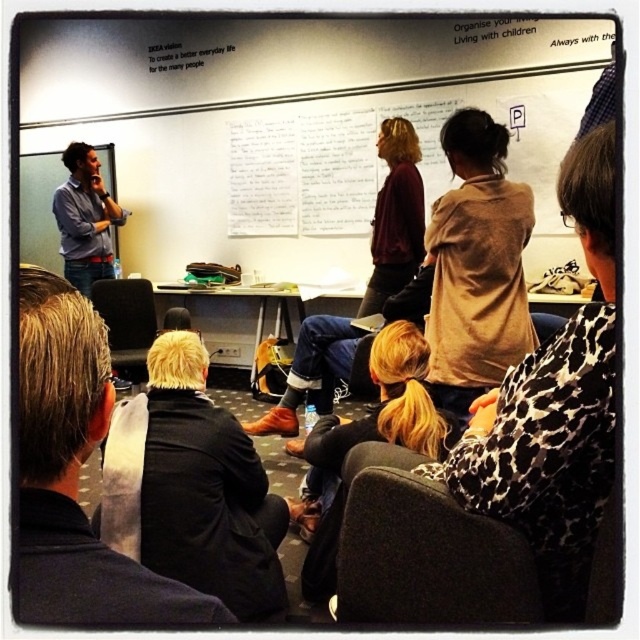
Does dark brown hair at lower left have a larger size compared to matte blue shirt at left?

Incorrect, dark brown hair at lower left is not larger than matte blue shirt at left.

Between dark brown hair at lower left and matte blue shirt at left, which one has more height?

Standing taller between the two is matte blue shirt at left.

What do you see at coordinates (74, 472) in the screenshot? I see `dark brown hair at lower left` at bounding box center [74, 472].

You are a GUI agent. You are given a task and a screenshot of the screen. Output one action in this format:
    pyautogui.click(x=<x>, y=<y>)
    Task: Click on the dark brown hair at lower left
    This screenshot has height=640, width=640.
    Given the screenshot: What is the action you would take?
    pyautogui.click(x=74, y=472)